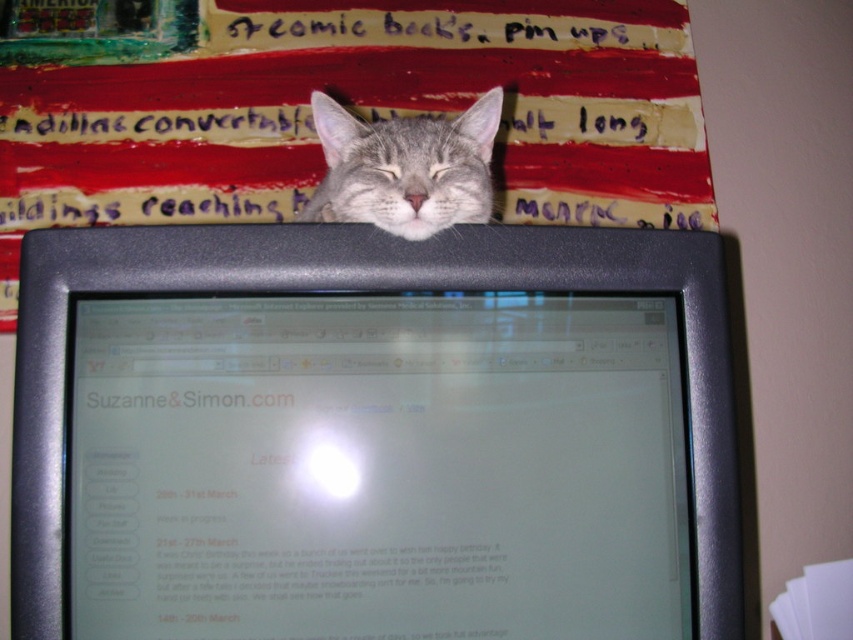
Question: Among these objects, which one is farthest from the camera?

Choices:
 (A) gray fur cat at upper center
 (B) matte black monitor at center

Answer: (A)

Question: Is matte black monitor at center thinner than gray fur cat at upper center?

Choices:
 (A) no
 (B) yes

Answer: (A)

Question: Is matte black monitor at center positioned behind gray fur cat at upper center?

Choices:
 (A) yes
 (B) no

Answer: (B)

Question: Can you confirm if matte black monitor at center is thinner than gray fur cat at upper center?

Choices:
 (A) yes
 (B) no

Answer: (B)